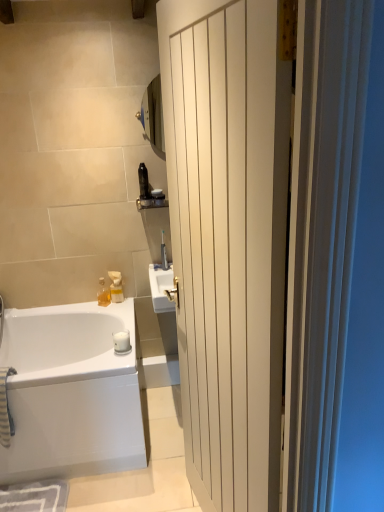
This screenshot has width=384, height=512. What do you see at coordinates (163, 256) in the screenshot? I see `satin nickel faucet at upper center` at bounding box center [163, 256].

I want to click on translucent glass bottle at lower left, which appears as the first toiletry when viewed from the left, so click(103, 293).

The image size is (384, 512). What do you see at coordinates (71, 392) in the screenshot? I see `white glossy bathtub at lower left` at bounding box center [71, 392].

At what (x,y) coordinates should I click in order to perform the action: click on translucent plastic soap dispenser at upper center, which is counted as the second toiletry, starting from the bottom. Please return your answer as a coordinate pair (x, y). Image resolution: width=384 pixels, height=512 pixels. Looking at the image, I should click on (116, 287).

Measure the distance between point (120, 300) and camera.

The distance of point (120, 300) from camera is 8.16 feet.

The width and height of the screenshot is (384, 512). Identify the location of black plastic bottle at upper center, which ranks as the 4th toiletry in bottom-to-top order. (143, 181).

The image size is (384, 512). I want to click on white matte soap at lower center, so click(121, 342).

How different are the orientations of matte black toothbrush at upper center, placed as the second toiletry when sorted from top to bottom, and white matte soap at lower center in degrees?

1.97 degrees separate the facing orientations of matte black toothbrush at upper center, placed as the second toiletry when sorted from top to bottom, and white matte soap at lower center.

Where is `soap below the matte black toothbrush at upper center, which is counted as the third toiletry, starting from the bottom (from a real-world perspective)`? The image size is (384, 512). soap below the matte black toothbrush at upper center, which is counted as the third toiletry, starting from the bottom (from a real-world perspective) is located at coordinates (121, 342).

Is white matte soap at lower center completely or partially inside matte black toothbrush at upper center, placed as the second toiletry when sorted from top to bottom?

No, white matte soap at lower center is not surrounded by matte black toothbrush at upper center, placed as the second toiletry when sorted from top to bottom.

From a real-world perspective, is matte black toothbrush at upper center, placed as the second toiletry when sorted from top to bottom, positioned above or below white matte soap at lower center?

Clearly, from a real-world perspective, matte black toothbrush at upper center, placed as the second toiletry when sorted from top to bottom, is above white matte soap at lower center.

Can we say matte black toothbrush at upper center, arranged as the fourth toiletry when viewed from the left, lies outside satin nickel faucet at upper center?

Yes, matte black toothbrush at upper center, arranged as the fourth toiletry when viewed from the left, is not within satin nickel faucet at upper center.

Looking at this image, from the image's perspective, is matte black toothbrush at upper center, the 1th toiletry viewed from the right, located beneath satin nickel faucet at upper center?

Actually, matte black toothbrush at upper center, the 1th toiletry viewed from the right, appears above satin nickel faucet at upper center in the image.

Based on their sizes in the image, would you say matte black toothbrush at upper center, the 1th toiletry viewed from the right, is bigger or smaller than satin nickel faucet at upper center?

Considering their sizes, matte black toothbrush at upper center, the 1th toiletry viewed from the right, takes up more space than satin nickel faucet at upper center.

Is satin nickel faucet at upper center in front of or behind translucent plastic soap dispenser at upper center, the 3th toiletry from the right, in the image?

satin nickel faucet at upper center is positioned closer to the viewer than translucent plastic soap dispenser at upper center, the 3th toiletry from the right.

Considering the sizes of objects satin nickel faucet at upper center and translucent plastic soap dispenser at upper center, which is counted as the second toiletry, starting from the bottom, in the image provided, who is thinner, satin nickel faucet at upper center or translucent plastic soap dispenser at upper center, which is counted as the second toiletry, starting from the bottom,?

With smaller width is satin nickel faucet at upper center.

Find the location of `faucet to the right of translucent plastic soap dispenser at upper center, the 3th toiletry from the right`. faucet to the right of translucent plastic soap dispenser at upper center, the 3th toiletry from the right is located at coordinates (163, 256).

How different are the orientations of white matte soap at lower center and matte black toothbrush at upper center, placed as the second toiletry when sorted from top to bottom, in degrees?

1.97 degrees.

Who is taller, white matte soap at lower center or matte black toothbrush at upper center, placed as the second toiletry when sorted from top to bottom?

white matte soap at lower center.

Is white matte soap at lower center located outside matte black toothbrush at upper center, which is counted as the third toiletry, starting from the bottom?

Yes, white matte soap at lower center is not within matte black toothbrush at upper center, which is counted as the third toiletry, starting from the bottom.

Considering their positions, is white matte soap at lower center located in front of or behind matte black toothbrush at upper center, arranged as the fourth toiletry when viewed from the left?

Visually, white matte soap at lower center is located in front of matte black toothbrush at upper center, arranged as the fourth toiletry when viewed from the left.

Find the location of a particular element. The height and width of the screenshot is (512, 384). the 2nd toiletry positioned above the satin nickel faucet at upper center (from the image's perspective) is located at coordinates (143, 181).

From the image's perspective, is satin nickel faucet at upper center located above or below black plastic bottle at upper center, which ranks as the first toiletry in top-to-bottom order?

satin nickel faucet at upper center is below black plastic bottle at upper center, which ranks as the first toiletry in top-to-bottom order.

Is satin nickel faucet at upper center facing towards black plastic bottle at upper center, which ranks as the first toiletry in top-to-bottom order?

No, satin nickel faucet at upper center is not oriented towards black plastic bottle at upper center, which ranks as the first toiletry in top-to-bottom order.

In the scene shown: Is translucent plastic soap dispenser at upper center, the 3th toiletry from the right, inside or outside of white glossy bathtub at lower left?

translucent plastic soap dispenser at upper center, the 3th toiletry from the right, is located beyond the bounds of white glossy bathtub at lower left.

Is translucent plastic soap dispenser at upper center, the 3th toiletry from the right, shorter than white glossy bathtub at lower left?

Correct, translucent plastic soap dispenser at upper center, the 3th toiletry from the right, is not as tall as white glossy bathtub at lower left.

Is translucent plastic soap dispenser at upper center, placed as the 3th toiletry when sorted from top to bottom, far away from white glossy bathtub at lower left?

translucent plastic soap dispenser at upper center, placed as the 3th toiletry when sorted from top to bottom, is near white glossy bathtub at lower left, not far away.

Is white wood door at center surrounded by black plastic bottle at upper center, which ranks as the third toiletry in left-to-right order?

Actually, white wood door at center is outside black plastic bottle at upper center, which ranks as the third toiletry in left-to-right order.

From the picture: Is black plastic bottle at upper center, which ranks as the third toiletry in left-to-right order, directly adjacent to white wood door at center?

No, black plastic bottle at upper center, which ranks as the third toiletry in left-to-right order, is not touching white wood door at center.

From the picture: Which is less distant, (x=148, y=191) or (x=238, y=47)?

Point (x=148, y=191) is positioned farther from the camera compared to point (x=238, y=47).

This screenshot has height=512, width=384. I want to click on soap that is in front of the matte black toothbrush at upper center, arranged as the fourth toiletry when viewed from the left, so click(x=121, y=342).

Identify the location of faucet on the right of the matte black toothbrush at upper center, placed as the second toiletry when sorted from top to bottom. This screenshot has height=512, width=384. (163, 256).

From the image, which object appears to be farther from satin nickel faucet at upper center, translucent glass bottle at lower left, marked as the 1th toiletry in a bottom-to-top arrangement, or matte black toothbrush at upper center, the 1th toiletry viewed from the right?

Based on the image, translucent glass bottle at lower left, marked as the 1th toiletry in a bottom-to-top arrangement, appears to be further to satin nickel faucet at upper center.

From the image, which object appears to be farther from white wood door at center, white matte soap at lower center or black plastic bottle at upper center, which ranks as the first toiletry in top-to-bottom order?

Among the two, white matte soap at lower center is located further to white wood door at center.

Looking at this image, from the image, which object appears to be farther from satin nickel faucet at upper center, matte black toothbrush at upper center, which is counted as the third toiletry, starting from the bottom, or black plastic bottle at upper center, which ranks as the first toiletry in top-to-bottom order?

black plastic bottle at upper center, which ranks as the first toiletry in top-to-bottom order, lies further to satin nickel faucet at upper center than the other object.

Which object lies nearer to the anchor point white wood door at center, satin nickel faucet at upper center or translucent plastic soap dispenser at upper center, which is counted as the second toiletry, starting from the bottom?

The object closer to white wood door at center is satin nickel faucet at upper center.

Estimate the real-world distances between objects in this image. Which object is further from translucent plastic soap dispenser at upper center, the 3th toiletry from the right, black plastic bottle at upper center, which ranks as the third toiletry in left-to-right order, or white glossy bathtub at lower left?

white glossy bathtub at lower left is positioned further to the anchor translucent plastic soap dispenser at upper center, the 3th toiletry from the right.

Based on their spatial positions, is black plastic bottle at upper center, arranged as the 2th toiletry when viewed from the right, or white matte soap at lower center closer to satin nickel faucet at upper center?

Among the two, black plastic bottle at upper center, arranged as the 2th toiletry when viewed from the right, is located nearer to satin nickel faucet at upper center.

Looking at the image, which one is located further to translucent plastic soap dispenser at upper center, placed as the 3th toiletry when sorted from top to bottom, white matte soap at lower center or white wood door at center?

white wood door at center is positioned further to the anchor translucent plastic soap dispenser at upper center, placed as the 3th toiletry when sorted from top to bottom.

Based on their spatial positions, is translucent glass bottle at lower left, positioned as the fourth toiletry in top-to-bottom order, or satin nickel faucet at upper center further from matte black toothbrush at upper center, which is counted as the third toiletry, starting from the bottom?

translucent glass bottle at lower left, positioned as the fourth toiletry in top-to-bottom order, is positioned further to the anchor matte black toothbrush at upper center, which is counted as the third toiletry, starting from the bottom.

Locate an element on the screen. This screenshot has height=512, width=384. soap between white wood door at center and satin nickel faucet at upper center from front to back is located at coordinates (121, 342).

The height and width of the screenshot is (512, 384). Identify the location of faucet that lies between matte black toothbrush at upper center, the 1th toiletry viewed from the right, and translucent glass bottle at lower left, positioned as the fourth toiletry in top-to-bottom order, from top to bottom. (163, 256).

Where is `bathtub positioned between white wood door at center and translucent plastic soap dispenser at upper center, which is counted as the second toiletry, starting from the bottom, from near to far`? This screenshot has width=384, height=512. bathtub positioned between white wood door at center and translucent plastic soap dispenser at upper center, which is counted as the second toiletry, starting from the bottom, from near to far is located at coordinates (71, 392).

The image size is (384, 512). Find the location of `toiletry between white wood door at center and matte black toothbrush at upper center, placed as the second toiletry when sorted from top to bottom, from front to back`. toiletry between white wood door at center and matte black toothbrush at upper center, placed as the second toiletry when sorted from top to bottom, from front to back is located at coordinates (143, 181).